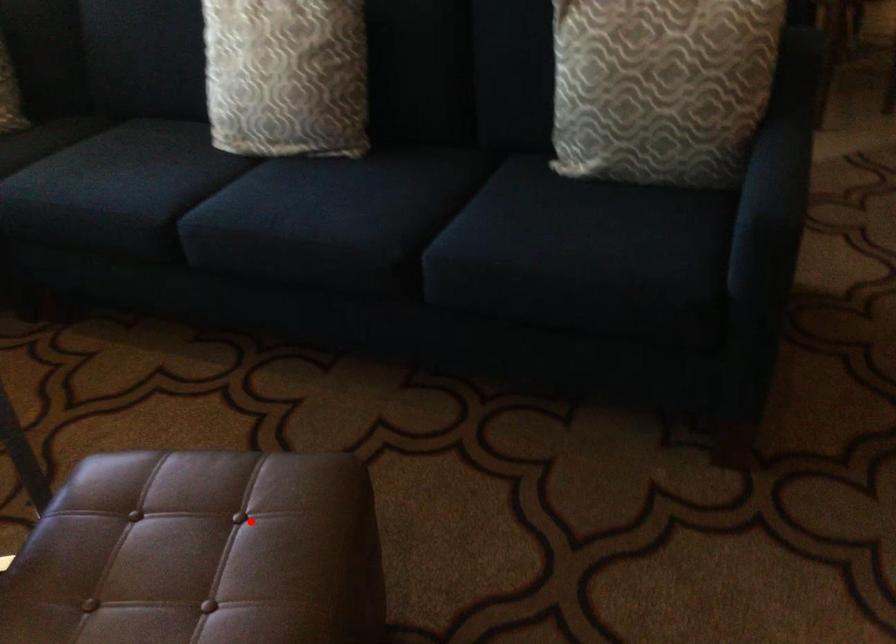
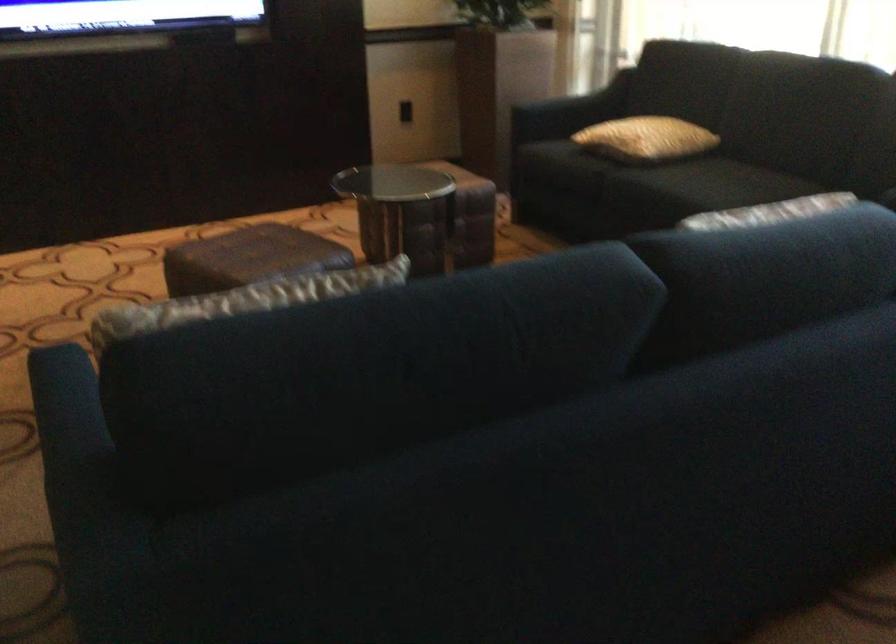
Question: A red point is marked in image1. In image2, is the corresponding 3D point closer to the camera or farther? Reply with the corresponding letter.

Choices:
 (A) The corresponding 3D point is closer.
 (B) The corresponding 3D point is farther.

Answer: (B)